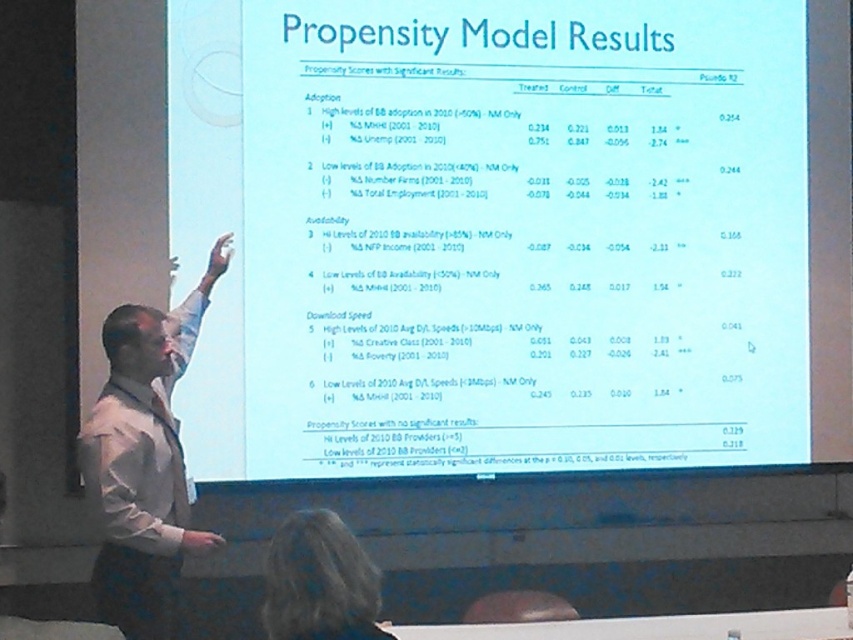
Question: Which point is closer to the camera?

Choices:
 (A) (88, 417)
 (B) (393, 168)

Answer: (A)

Question: Is white paper at upper center wider than white shirt at left?

Choices:
 (A) yes
 (B) no

Answer: (A)

Question: Can you confirm if white paper at upper center is positioned below white shirt at left?

Choices:
 (A) yes
 (B) no

Answer: (B)

Question: Among these objects, which one is farthest from the camera?

Choices:
 (A) white shirt at left
 (B) white paper at upper center

Answer: (B)

Question: Which object appears farthest from the camera in this image?

Choices:
 (A) white paper at upper center
 (B) white shirt at left

Answer: (A)

Question: Does white paper at upper center appear under white shirt at left?

Choices:
 (A) yes
 (B) no

Answer: (B)